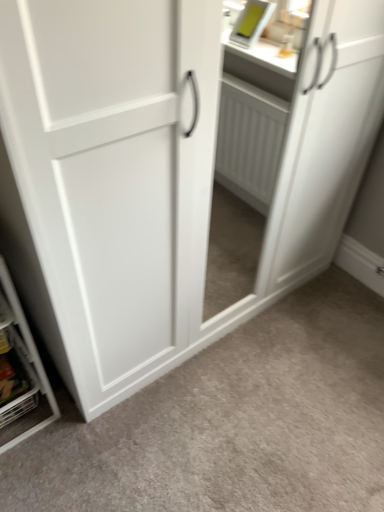
The height and width of the screenshot is (512, 384). In order to click on vacant area that is situated to the right of metallic silver shelf at lower left in this screenshot , I will do `click(118, 426)`.